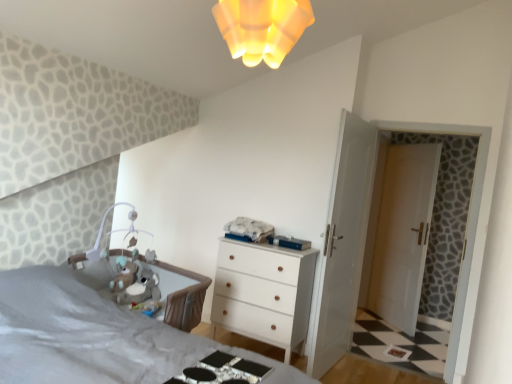
Question: From the image's perspective, is white glossy door at right positioned above or below soft plush toy at center?

Choices:
 (A) below
 (B) above

Answer: (B)

Question: Considering the relative positions of white glossy door at right and soft plush toy at center in the image provided, is white glossy door at right to the left or to the right of soft plush toy at center?

Choices:
 (A) right
 (B) left

Answer: (A)

Question: Which object is positioned farthest from the white matte chest of drawers at center?

Choices:
 (A) white glossy door at center, positioned as the 2th door in back-to-front order
 (B) white glossy door at right, placed as the 2th door when sorted from left to right
 (C) soft plush toy at center
 (D) yellow frosted glass light fixture at upper center
 (E) metallic silver changing table at lower center

Answer: (D)

Question: Based on their relative distances, which object is farther from the white glossy door at right, positioned as the 2th door in front-to-back order?

Choices:
 (A) white glossy door at right
 (B) white matte chest of drawers at center
 (C) metallic silver changing table at lower center
 (D) white glossy door at center, which ranks as the 2th door in right-to-left order
 (E) yellow frosted glass light fixture at upper center

Answer: (E)